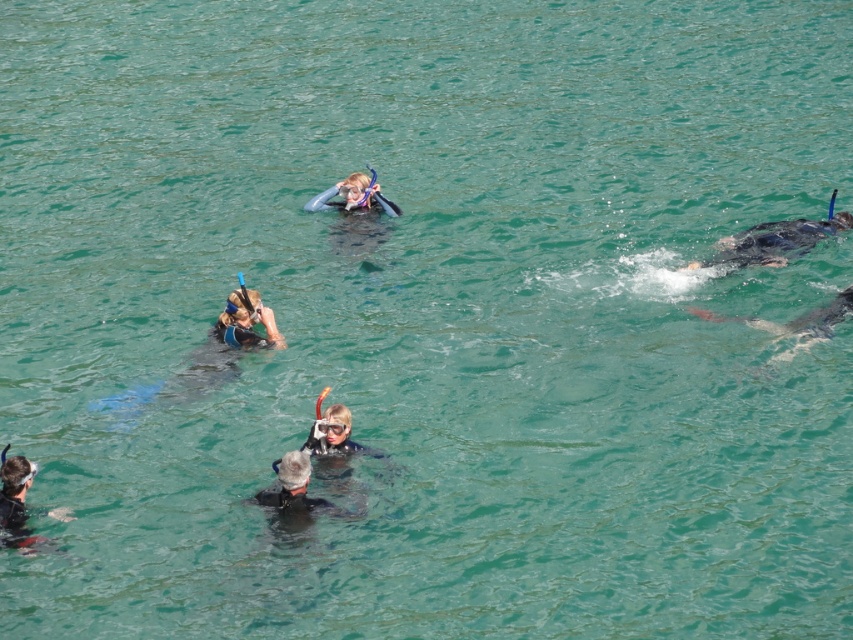
You are a photographer taking a picture of the snorkeling scene. You want to focus on the point at the bottom of the image. Which point should you focus on to ensure the bottom part is in focus? The options are point at point (341, 225) and point at point (27, 474).

To focus on the bottom part of the image, you should select point at point (27, 474) because it is closer to the bottom of the image compared to point at point (341, 225).

You are a snorkeler preparing to dive into the water. You see two sets of gear in the image. Which one is positioned higher up, the black rubber snorkeling gear at center or the matte black snorkel gear at lower left?

The black rubber snorkeling gear at center is positioned higher up than the matte black snorkel gear at lower left.